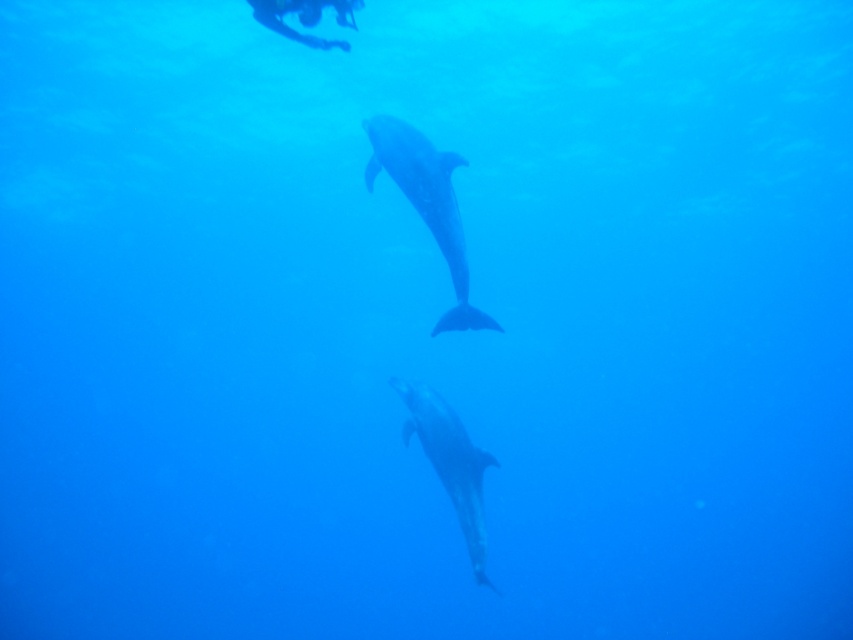
Question: Observing the image, what is the correct spatial positioning of glossy dolphin at center in reference to blue rubber mask at upper center?

Choices:
 (A) below
 (B) above

Answer: (A)

Question: Can you confirm if smooth gray dolphin at center is positioned above blue rubber mask at upper center?

Choices:
 (A) no
 (B) yes

Answer: (A)

Question: Is glossy dolphin at center wider than blue rubber mask at upper center?

Choices:
 (A) yes
 (B) no

Answer: (A)

Question: Which point appears closest to the camera in this image?

Choices:
 (A) (444, 212)
 (B) (451, 499)
 (C) (309, 44)

Answer: (C)

Question: Which of the following is the closest to the observer?

Choices:
 (A) blue rubber mask at upper center
 (B) smooth gray dolphin at center
 (C) glossy dolphin at center

Answer: (A)

Question: Among these points, which one is farthest from the camera?

Choices:
 (A) (375, 138)
 (B) (282, 33)

Answer: (A)